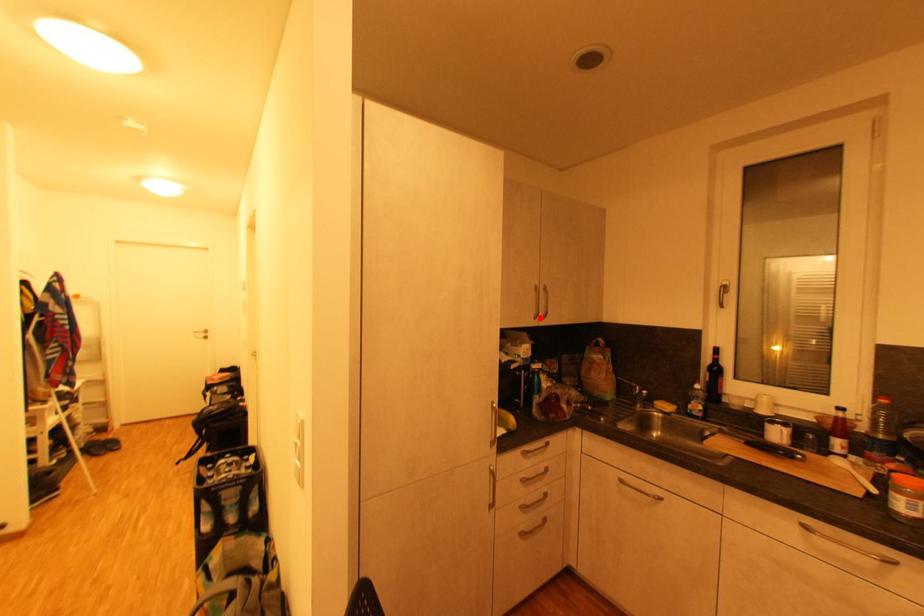
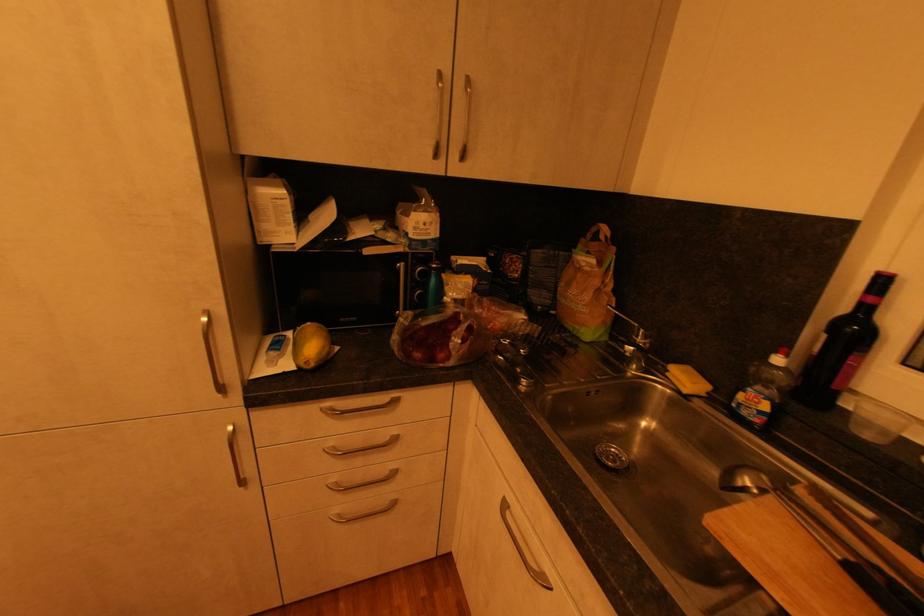
Locate, in the second image, the point that corresponds to the highlighted location in the first image.

(441, 156)